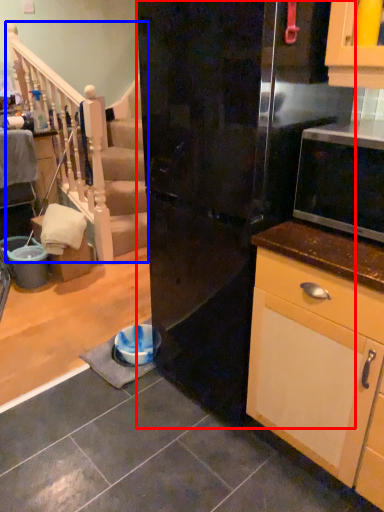
Question: Which point is closer to the camera, refrigerator (highlighted by a red box) or rail (highlighted by a blue box)?

Choices:
 (A) refrigerator
 (B) rail

Answer: (A)